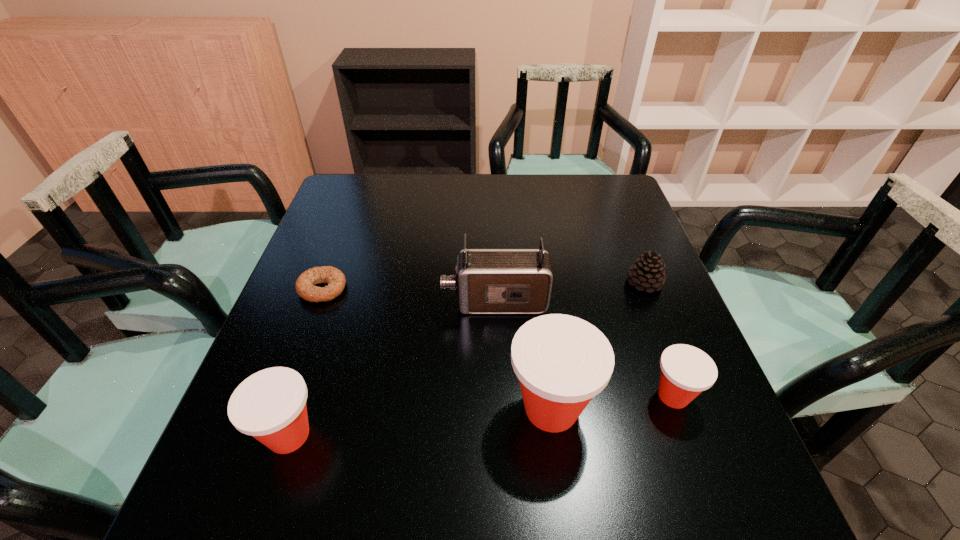
This screenshot has height=540, width=960. Identify the location of free spot between the pinecone and the shortest Dixie cup. (659, 339).

Identify the location of free spot between the shortest object and the camcorder. Image resolution: width=960 pixels, height=540 pixels. (409, 295).

The height and width of the screenshot is (540, 960). Identify the location of vacant area between the leftmost Dixie cup and the camcorder. (392, 369).

I want to click on vacant area that lies between the tallest Dixie cup and the bagel, so click(x=437, y=348).

The width and height of the screenshot is (960, 540). In order to click on free point between the rightmost Dixie cup and the pinecone in this screenshot , I will do `click(659, 339)`.

Locate an element on the screen. The height and width of the screenshot is (540, 960). free space between the second Dixie cup from left to right and the rightmost Dixie cup is located at coordinates (612, 402).

Where is `empty space that is in between the third tallest object and the shortest Dixie cup`? This screenshot has width=960, height=540. empty space that is in between the third tallest object and the shortest Dixie cup is located at coordinates (481, 415).

You are a GUI agent. You are given a task and a screenshot of the screen. Output one action in this format:
    pyautogui.click(x=<x>, y=<y>)
    Task: Click on the object that stands as the fifth closest to the tallest Dixie cup
    This screenshot has width=960, height=540.
    Given the screenshot: What is the action you would take?
    pyautogui.click(x=304, y=285)

Select which object appears as the third closest to the shortest object. Please provide its 2D coordinates. Your answer should be formatted as a tuple, i.e. [(x, y)], where the tuple contains the x and y coordinates of a point satisfying the conditions above.

[(562, 362)]

Locate which Dixie cup ranks second in proximity to the second Dixie cup from right to left. Please provide its 2D coordinates. Your answer should be formatted as a tuple, i.e. [(x, y)], where the tuple contains the x and y coordinates of a point satisfying the conditions above.

[(270, 405)]